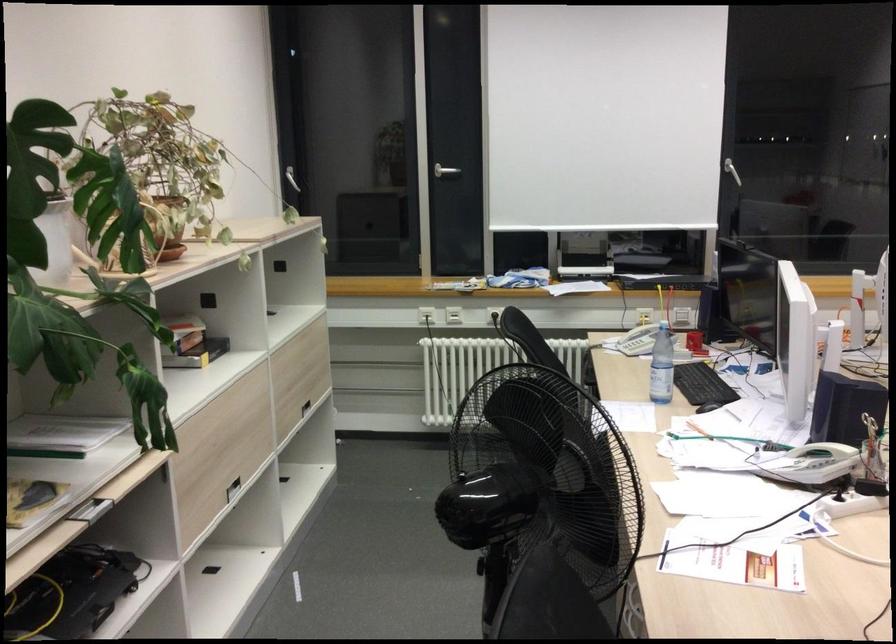
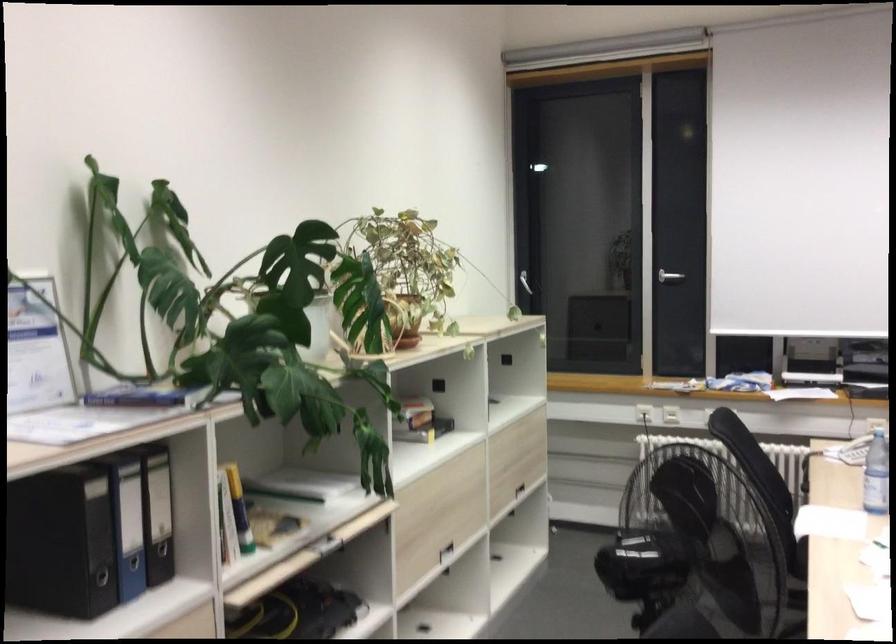
The images are taken continuously from a first-person perspective. In which direction are you moving?

The cameraman walked toward right, backward.